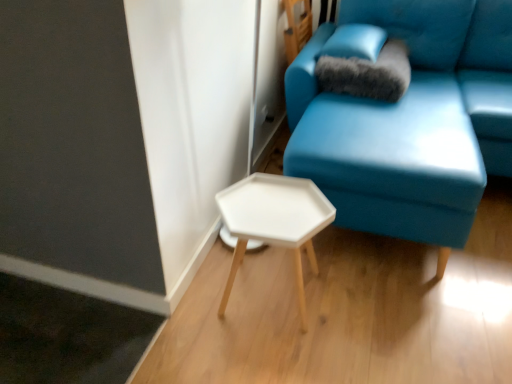
Question: Is satin blue pillow at upper right, placed as the 2th pillow when sorted from bottom to top, looking in the opposite direction of fuzzy gray pillow at upper right, positioned as the second pillow in top-to-bottom order?

Choices:
 (A) no
 (B) yes

Answer: (A)

Question: Is satin blue pillow at upper right, placed as the 2th pillow when sorted from bottom to top, not within fuzzy gray pillow at upper right, positioned as the second pillow in top-to-bottom order?

Choices:
 (A) no
 (B) yes

Answer: (B)

Question: Considering the relative positions of satin blue pillow at upper right, marked as the 1th pillow in a top-to-bottom arrangement, and fuzzy gray pillow at upper right, positioned as the second pillow in top-to-bottom order, in the image provided, is satin blue pillow at upper right, marked as the 1th pillow in a top-to-bottom arrangement, behind fuzzy gray pillow at upper right, positioned as the second pillow in top-to-bottom order,?

Choices:
 (A) no
 (B) yes

Answer: (B)

Question: From the image's perspective, is satin blue pillow at upper right, marked as the 1th pillow in a top-to-bottom arrangement, on top of fuzzy gray pillow at upper right, positioned as the second pillow in top-to-bottom order?

Choices:
 (A) yes
 (B) no

Answer: (A)

Question: Is satin blue pillow at upper right, marked as the 1th pillow in a top-to-bottom arrangement, facing towards fuzzy gray pillow at upper right, positioned as the second pillow in top-to-bottom order?

Choices:
 (A) yes
 (B) no

Answer: (B)

Question: From the image's perspective, relative to matte blue couch at center, is white matte hexagonal table at center above or below?

Choices:
 (A) below
 (B) above

Answer: (A)

Question: From a real-world perspective, is white matte hexagonal table at center positioned above or below matte blue couch at center?

Choices:
 (A) below
 (B) above

Answer: (A)

Question: Is point (294, 238) positioned closer to the camera than point (464, 132)?

Choices:
 (A) farther
 (B) closer

Answer: (B)

Question: Based on their positions, is white matte hexagonal table at center located to the left or right of matte blue couch at center?

Choices:
 (A) right
 (B) left

Answer: (B)

Question: Visually, is matte blue couch at center positioned to the left or to the right of satin blue pillow at upper right, marked as the 1th pillow in a top-to-bottom arrangement?

Choices:
 (A) right
 (B) left

Answer: (A)

Question: From a real-world perspective, is matte blue couch at center above or below satin blue pillow at upper right, marked as the 1th pillow in a top-to-bottom arrangement?

Choices:
 (A) above
 (B) below

Answer: (B)

Question: Is point (435, 152) positioned closer to the camera than point (356, 33)?

Choices:
 (A) farther
 (B) closer

Answer: (B)

Question: Looking at their shapes, would you say matte blue couch at center is wider or thinner than satin blue pillow at upper right, marked as the 1th pillow in a top-to-bottom arrangement?

Choices:
 (A) wide
 (B) thin

Answer: (A)

Question: In terms of height, does matte blue couch at center look taller or shorter compared to white matte hexagonal table at center?

Choices:
 (A) tall
 (B) short

Answer: (A)

Question: In the image, is matte blue couch at center on the left side or the right side of white matte hexagonal table at center?

Choices:
 (A) right
 (B) left

Answer: (A)